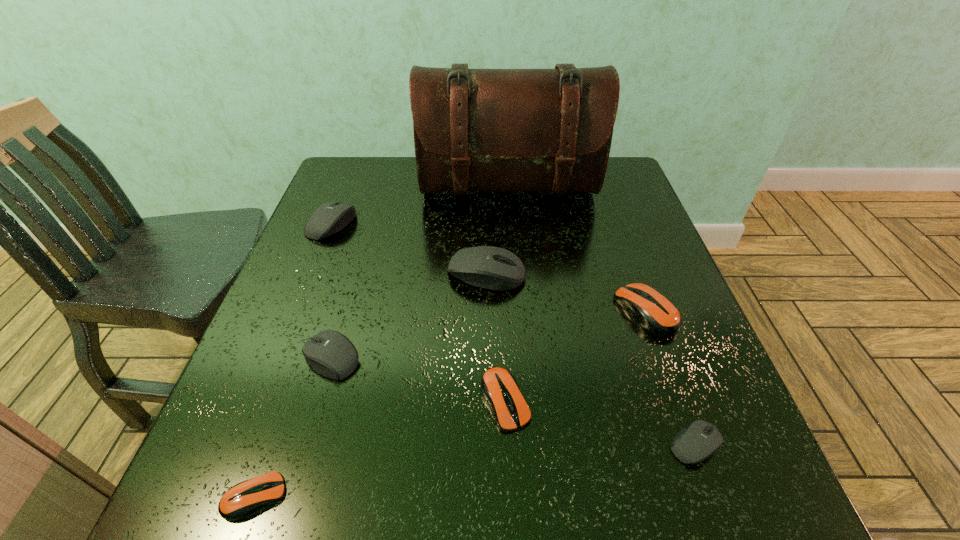
You are a GUI agent. You are given a task and a screenshot of the screen. Output one action in this format:
    pyautogui.click(x=<x>, y=<y>)
    Task: Click on the vacant area that lies between the second orange computer mouse from left to right and the sixth shortest object
    The width and height of the screenshot is (960, 540).
    Given the screenshot: What is the action you would take?
    pyautogui.click(x=419, y=312)

The width and height of the screenshot is (960, 540). What are the coordinates of `free space between the smallest black computer equipment and the farthest black computer equipment` in the screenshot? It's located at (514, 334).

Locate an element on the screen. This screenshot has width=960, height=540. vacant area between the second biggest orange computer mouse and the second smallest black computer equipment is located at coordinates (419, 380).

Find the location of a particular element. unoccupied area between the nearest black computer equipment and the second farthest black computer equipment is located at coordinates (590, 359).

Select which object is the fifth closest to the second tallest object. Please provide its 2D coordinates. Your answer should be formatted as a tuple, i.e. [(x, y)], where the tuple contains the x and y coordinates of a point satisfying the conditions above.

[(331, 217)]

This screenshot has width=960, height=540. Find the location of `object that is the sixth closest to the rightmost orange computer mouse`. object that is the sixth closest to the rightmost orange computer mouse is located at coordinates (331, 217).

Where is `the sixth closest computer mouse relative to the tallest object`? The image size is (960, 540). the sixth closest computer mouse relative to the tallest object is located at coordinates (700, 440).

Find the location of a particular element. This screenshot has height=540, width=960. the closest computer mouse relative to the smallest black computer equipment is located at coordinates (655, 313).

Identify which black computer equipment is the third nearest to the third biggest black computer equipment. Please provide its 2D coordinates. Your answer should be formatted as a tuple, i.e. [(x, y)], where the tuple contains the x and y coordinates of a point satisfying the conditions above.

[(700, 440)]

You are a GUI agent. You are given a task and a screenshot of the screen. Output one action in this format:
    pyautogui.click(x=<x>, y=<y>)
    Task: Click on the black computer equipment that is the nearest to the tallest computer mouse
    
    Given the screenshot: What is the action you would take?
    pyautogui.click(x=331, y=354)